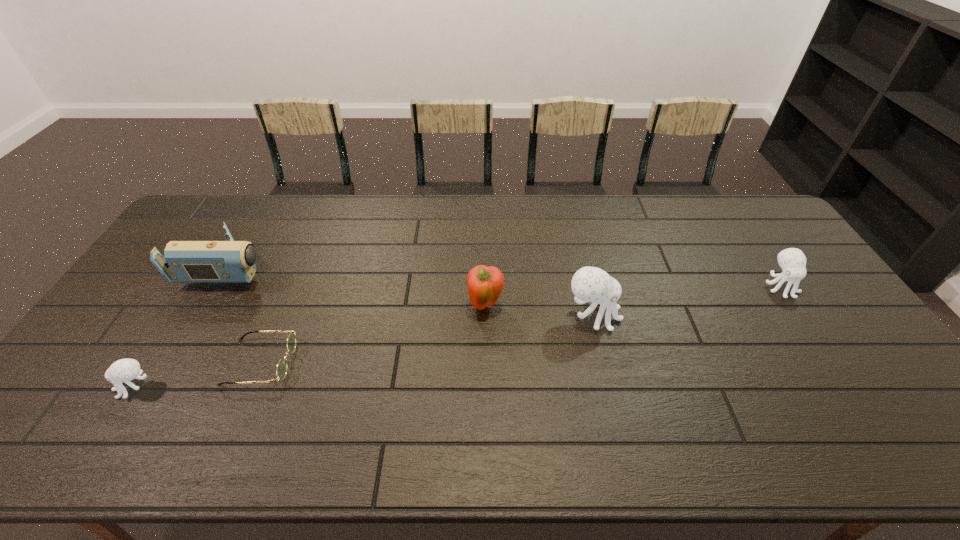
The height and width of the screenshot is (540, 960). Identify the location of camcorder present at the left edge. (231, 261).

Where is `object that is at the right edge`? The height and width of the screenshot is (540, 960). object that is at the right edge is located at coordinates (792, 261).

The image size is (960, 540). In order to click on object positioned at the near left corner in this screenshot , I will do `click(124, 370)`.

The image size is (960, 540). What are the coordinates of `vacant space at the far edge of the desktop` in the screenshot? It's located at 298,203.

The width and height of the screenshot is (960, 540). Find the location of `vacant region at the near edge of the desktop`. vacant region at the near edge of the desktop is located at coordinates (452, 395).

Locate an element on the screen. free region at the right edge of the desktop is located at coordinates (836, 328).

Where is `free space at the far right corner`? The width and height of the screenshot is (960, 540). free space at the far right corner is located at coordinates (763, 228).

The height and width of the screenshot is (540, 960). Find the location of `empty space between the rightmost object and the spectacles`. empty space between the rightmost object and the spectacles is located at coordinates (520, 324).

I want to click on empty space that is in between the pepper and the rightmost octopus, so click(633, 296).

Locate an element on the screen. The height and width of the screenshot is (540, 960). vacant area that lies between the spectacles and the pepper is located at coordinates (372, 334).